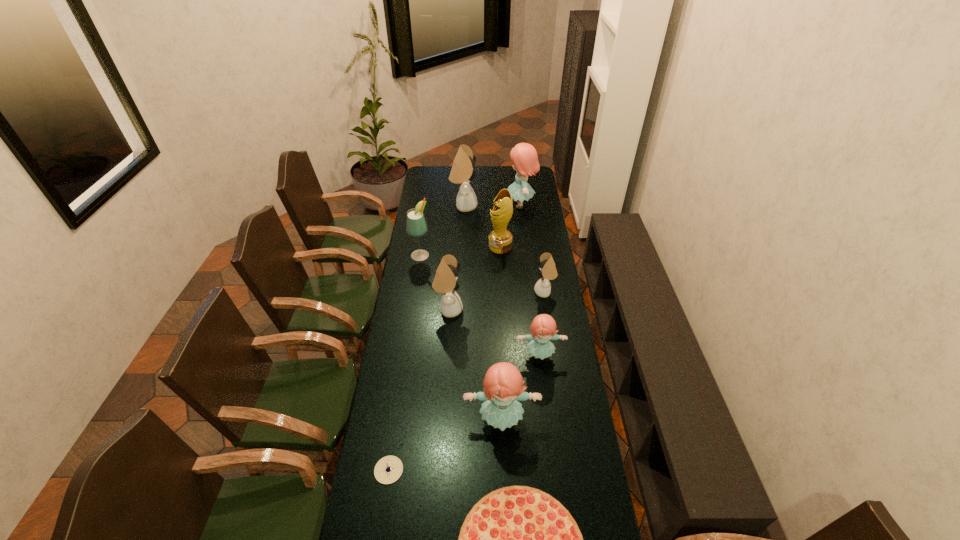
The image size is (960, 540). I want to click on vacant space located 0.370m at the front face of the second biggest black doll, so click(546, 309).

The height and width of the screenshot is (540, 960). Identify the location of vacant space located 0.300m on the front-facing side of the nearest blue doll. (506, 538).

At what (x,y) coordinates should I click in order to perform the action: click on vacant position located at the front face of the smallest black doll. Please return your answer as a coordinate pair (x, y). The height and width of the screenshot is (540, 960). Looking at the image, I should click on (454, 292).

This screenshot has width=960, height=540. I want to click on vacant space located 0.320m at the front face of the smallest black doll, so click(465, 292).

The height and width of the screenshot is (540, 960). Identify the location of vacant point located at the front face of the smallest black doll. (487, 292).

Where is `vacant region located 0.290m on the front-facing side of the second nearest doll`? The image size is (960, 540). vacant region located 0.290m on the front-facing side of the second nearest doll is located at coordinates (550, 437).

Locate an element on the screen. The width and height of the screenshot is (960, 540). blank area located on the right of the ninth tallest object is located at coordinates (424, 470).

At what (x,y) coordinates should I click in order to perform the action: click on alcohol that is at the left edge. Please return your answer as a coordinate pair (x, y). This screenshot has width=960, height=540. Looking at the image, I should click on (416, 226).

This screenshot has height=540, width=960. Identify the location of compass that is at the left edge. (388, 469).

Locate an element on the screen. blank space at the far edge is located at coordinates (481, 170).